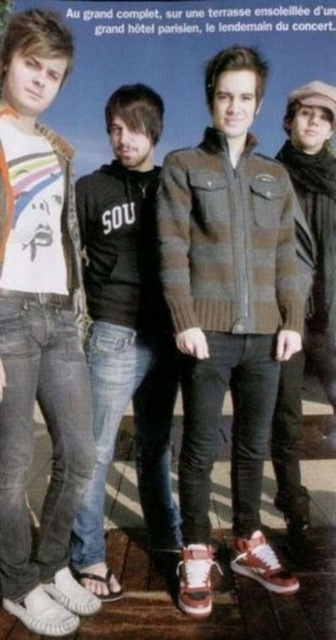
Question: Does striped wool sweater at center appear under black cotton hoodie at center?

Choices:
 (A) no
 (B) yes

Answer: (A)

Question: Does striped wool sweater at center appear on the right side of white matte t-shirt at left?

Choices:
 (A) no
 (B) yes

Answer: (B)

Question: Does striped wool sweater at center appear on the left side of white matte t-shirt at left?

Choices:
 (A) no
 (B) yes

Answer: (A)

Question: Which object appears closest to the camera in this image?

Choices:
 (A) black cotton hoodie at center
 (B) white matte t-shirt at left
 (C) striped wool sweater at center

Answer: (B)

Question: Which point appears farthest from the camera in this image?

Choices:
 (A) (224, 147)
 (B) (286, 106)
 (C) (130, 170)

Answer: (B)

Question: Estimate the real-world distances between objects in this image. Which object is farther from the brown woolen sweater at right?

Choices:
 (A) striped wool sweater at center
 (B) white matte t-shirt at left

Answer: (B)